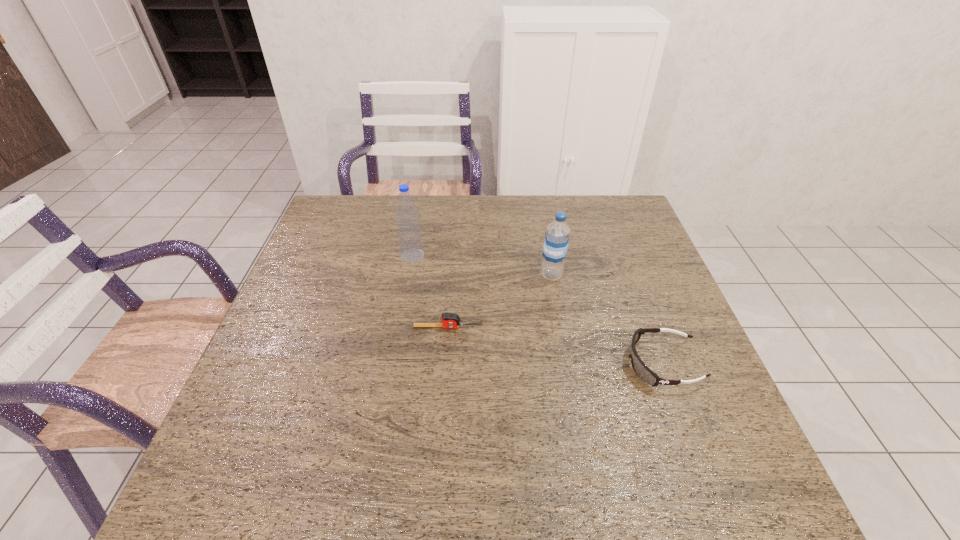
You are a GUI agent. You are given a task and a screenshot of the screen. Output one action in this format:
    pyautogui.click(x=<x>, y=<y>)
    Task: Click on the free space between the leftmost object and the shortest object
    The image size is (960, 540).
    Given the screenshot: What is the action you would take?
    pyautogui.click(x=430, y=292)

At what (x,y) coordinates should I click in order to perform the action: click on object that is the second closest one to the second object from right to left. Please return your answer as a coordinate pair (x, y). The height and width of the screenshot is (540, 960). Looking at the image, I should click on point(643,372).

Where is `object that is the second nearest to the nearest object`? Image resolution: width=960 pixels, height=540 pixels. object that is the second nearest to the nearest object is located at coordinates (449, 320).

You are a GUI agent. You are given a task and a screenshot of the screen. Output one action in this format:
    pyautogui.click(x=<x>, y=<y>)
    Task: Click on the vacant position in the image that satisfies the following two spatial constraints: 1. on the front side of the third object from right to left; 2. on the left side of the left water bottle
    The width and height of the screenshot is (960, 540).
    Given the screenshot: What is the action you would take?
    pyautogui.click(x=399, y=327)

The width and height of the screenshot is (960, 540). I want to click on vacant space that satisfies the following two spatial constraints: 1. on the label of the right water bottle; 2. on the front side of the shortest object, so click(561, 327).

Where is `free spot that satisfies the following two spatial constraints: 1. on the label of the nearer water bottle; 2. on the front side of the shortest object`? free spot that satisfies the following two spatial constraints: 1. on the label of the nearer water bottle; 2. on the front side of the shortest object is located at coordinates (561, 327).